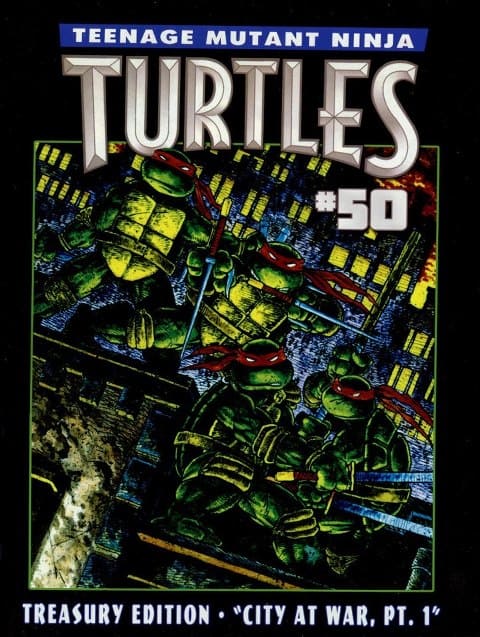
Locate an element on the screen. This screenshot has width=480, height=637. green frame is located at coordinates (436, 474).